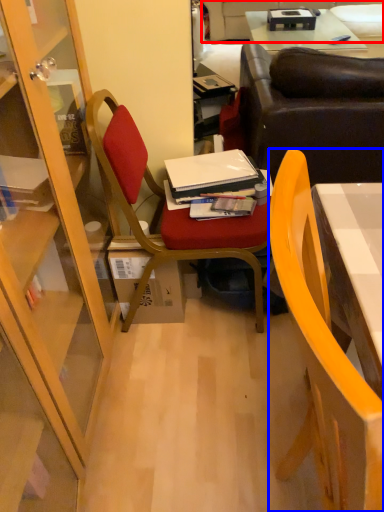
Question: Which object appears closest to the camera in this image, couch (highlighted by a red box) or chair (highlighted by a blue box)?

Choices:
 (A) couch
 (B) chair

Answer: (B)